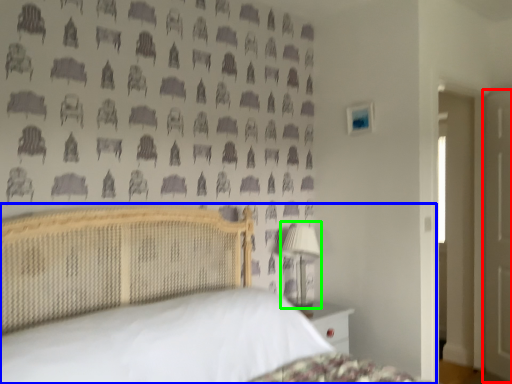
Question: Which object is the closest to the door (highlighted by a red box)? Choose among these: bed (highlighted by a blue box) or table lamp (highlighted by a green box).

Choices:
 (A) bed
 (B) table lamp

Answer: (B)